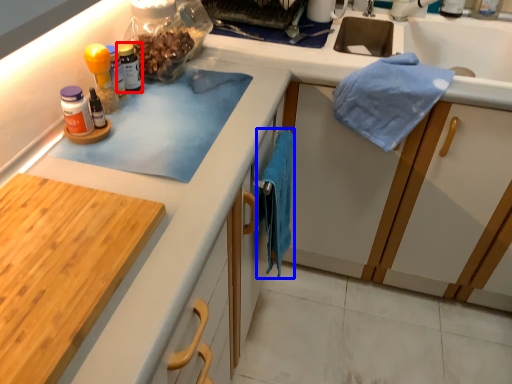
Question: Which object is further to the camera taking this photo, bottle (highlighted by a red box) or bath towel (highlighted by a blue box)?

Choices:
 (A) bottle
 (B) bath towel

Answer: (A)